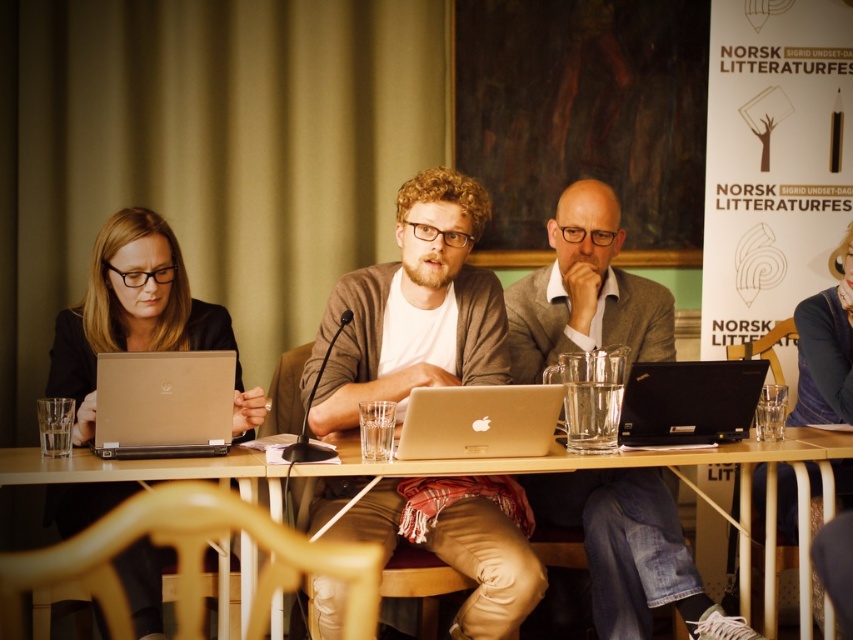
You are a fashion student observing the attendees at the NORSK LITTERATURFEST. You notice two garments at center stage. Which garment is located to the left of the other? The two garments are the matte brown cardigan at center and the matte gray blazer at center.

The matte brown cardigan at center is positioned on the left side of the matte gray blazer at center.

You are organizing a clothing donation drive and need to know which item is more suitable for a small backpack. Based on the scene, which is thinner between the matte gray blazer at center and the wooden at center?

The matte gray blazer at center is thinner than the wooden at center, so it would be more suitable for a small backpack.

You are a photographer at the event and want to take a photo of the matte gray blazer at center and the wooden at center. Based on their positions, which object will appear larger in the photo?

The matte gray blazer at center will appear larger in the photo because it is closer to the viewer than the wooden at center.